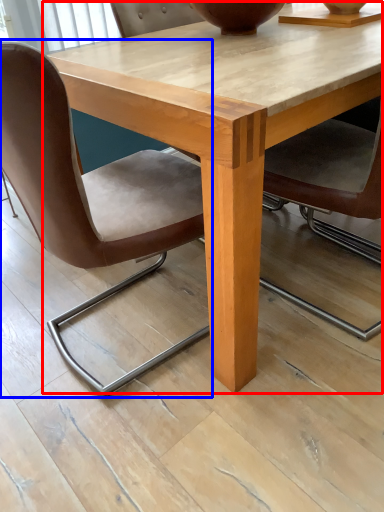
Question: Which object is closer to the camera taking this photo, coffee table (highlighted by a red box) or chair (highlighted by a blue box)?

Choices:
 (A) coffee table
 (B) chair

Answer: (B)